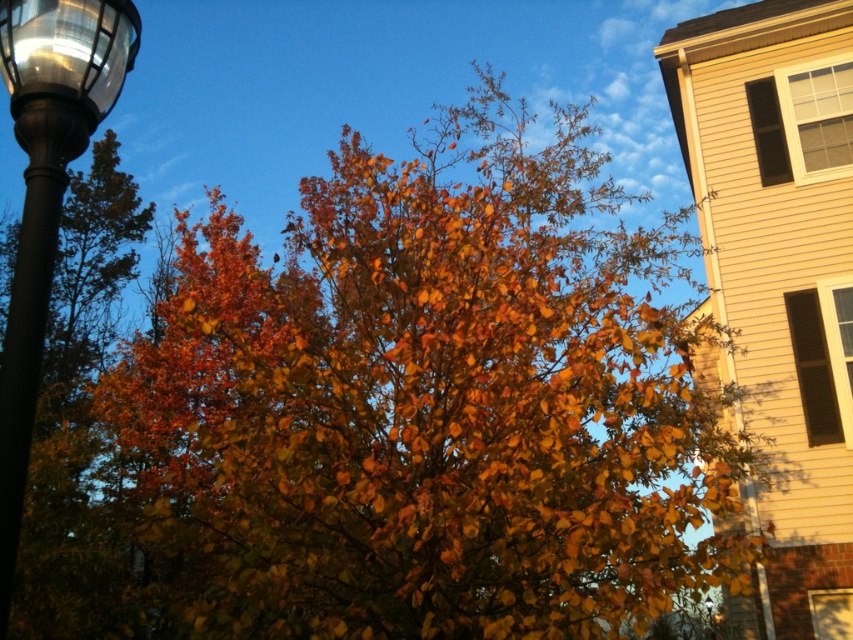
Question: Which point is farther from the camera taking this photo?

Choices:
 (A) (242, 320)
 (B) (88, 0)
 (C) (73, 83)

Answer: (A)

Question: Does autumn leaves at center lie behind metallic glass streetlight at upper left?

Choices:
 (A) yes
 (B) no

Answer: (A)

Question: Which object appears closest to the camera in this image?

Choices:
 (A) metallic glass streetlight at upper left
 (B) polished metal street light at left

Answer: (B)

Question: Can you confirm if polished metal street light at left is positioned above metallic glass streetlight at upper left?

Choices:
 (A) yes
 (B) no

Answer: (B)

Question: Is autumn leaves at center smaller than polished metal street light at left?

Choices:
 (A) yes
 (B) no

Answer: (B)

Question: Estimate the real-world distances between objects in this image. Which object is farther from the polished metal street light at left?

Choices:
 (A) metallic glass streetlight at upper left
 (B) autumn leaves at center

Answer: (B)